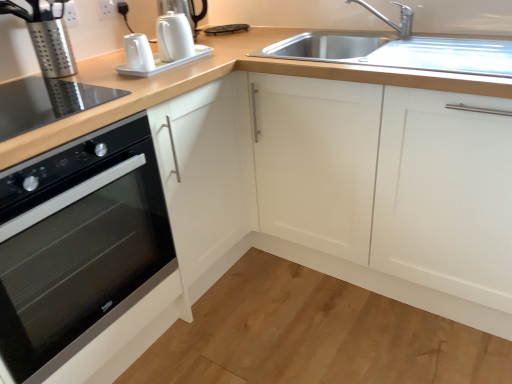
Question: In the image, is black glass cooktop at lower left, the first appliance in the bottom-to-top sequence, on the left side or the right side of silver metallic faucet at upper right?

Choices:
 (A) left
 (B) right

Answer: (A)

Question: Is point (106, 92) closer or farther from the camera than point (403, 11)?

Choices:
 (A) closer
 (B) farther

Answer: (A)

Question: Estimate the real-world distances between objects in this image. Which object is closer to the smooth wood floor at lower center?

Choices:
 (A) white glossy kettle at upper center, which appears as the 2th appliance when viewed from the top
 (B) white glossy electric kettle at upper center, which is counted as the first appliance, starting from the top
 (C) silver perforated coffee machine at left, placed as the 1th coffee machine when sorted from left to right
 (D) white matte cabinet at upper right
 (E) black glass oven at left

Answer: (D)

Question: Based on their relative distances, which object is farther from the silver metallic faucet at upper right?

Choices:
 (A) white glossy electric kettle at upper center, which is counted as the first appliance, starting from the top
 (B) black glass oven at left
 (C) white matte cabinet at upper right
 (D) white glossy coffee machine at upper center, the 1th coffee machine from the right
 (E) silver perforated coffee machine at left, placed as the 1th coffee machine when sorted from left to right

Answer: (B)